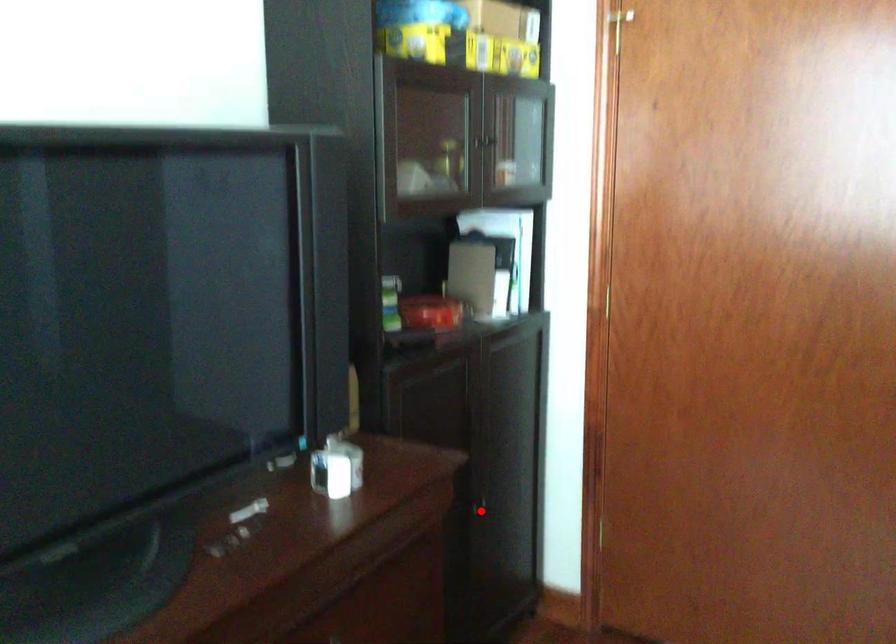
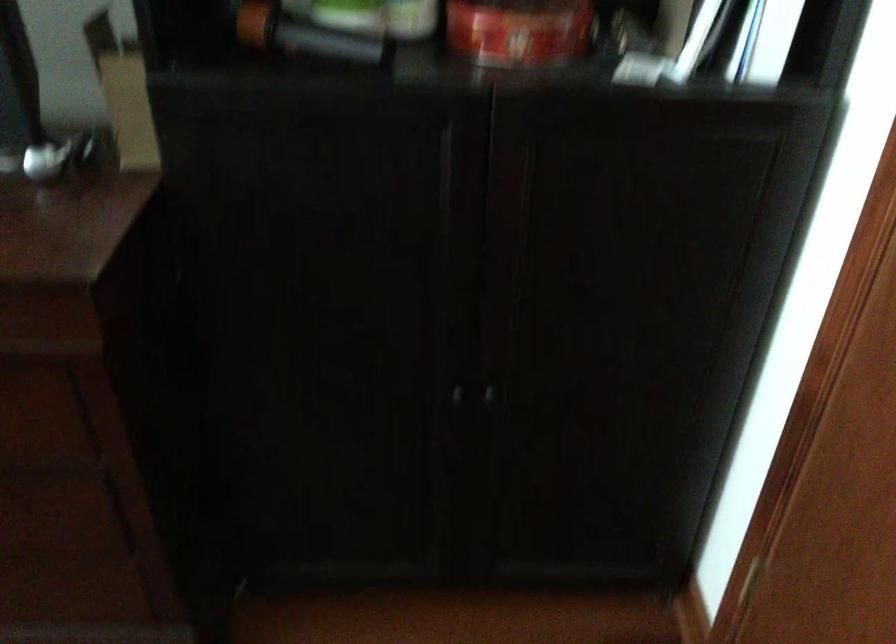
Question: I am providing you with two images of the same scene from different viewpoints. In image1, a red point is highlighted. Considering the same 3D point in image2, which of the following is correct?

Choices:
 (A) It is closer
 (B) It is farther

Answer: (A)